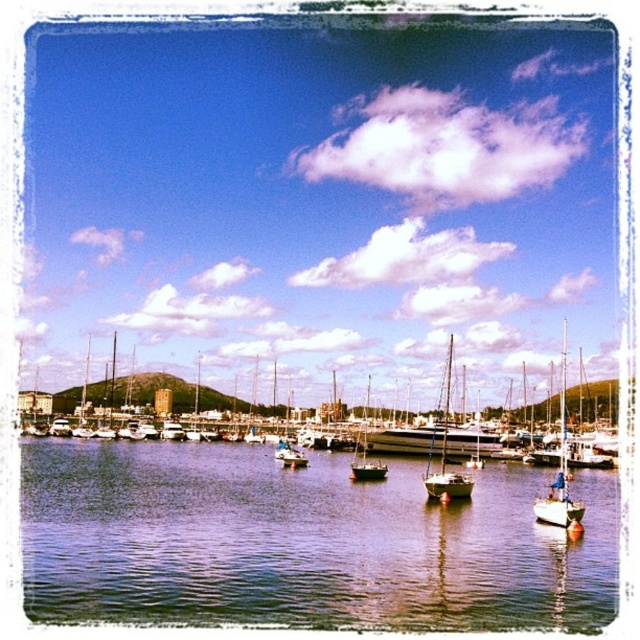
Does shiny dark water at center appear under white matte sailboat at center?

Yes, shiny dark water at center is below white matte sailboat at center.

Which is below, shiny dark water at center or white matte sailboat at center?

shiny dark water at center is lower down.

Find the location of `shiny dark water at center`. shiny dark water at center is located at coordinates (300, 541).

In order to click on shiny dark water at center in this screenshot , I will do `click(300, 541)`.

Based on the photo, is white matte sailboat at center positioned behind smooth white sailboat at center?

That is False.

Does white matte sailboat at center have a greater width compared to smooth white sailboat at center?

Yes, white matte sailboat at center is wider than smooth white sailboat at center.

At what (x,y) coordinates should I click in order to perform the action: click on white matte sailboat at center. Please return your answer as a coordinate pair (x, y). The height and width of the screenshot is (640, 640). Looking at the image, I should click on (445, 452).

Is shiny dark water at center taller than white matte sailboat at right?

Incorrect, shiny dark water at center's height is not larger of white matte sailboat at right's.

Is point (204, 545) behind point (561, 388)?

No.

Does point (273, 608) lie in front of point (563, 326)?

Yes, it is.

This screenshot has width=640, height=640. Identify the location of shiny dark water at center. (300, 541).